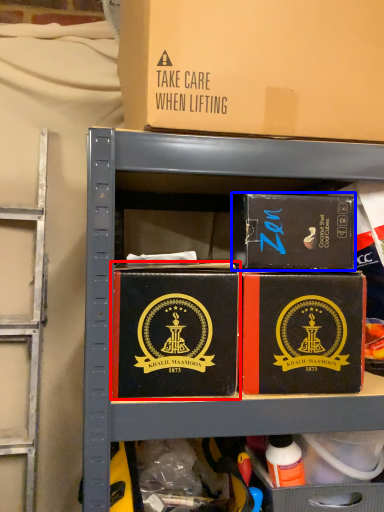
Question: Which object appears closest to the camera in this image, box (highlighted by a red box) or box (highlighted by a blue box)?

Choices:
 (A) box
 (B) box

Answer: (A)